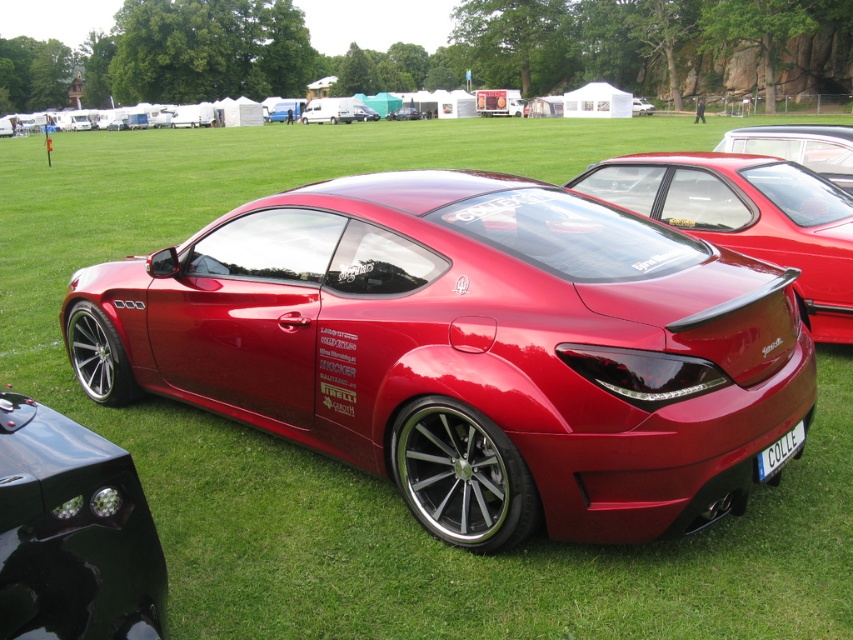
Question: Which of the following is the farthest from the observer?

Choices:
 (A) glossy metallic car at center
 (B) shiny red car at center

Answer: (A)

Question: Does glossy red car at center have a greater width compared to glossy metallic car at center?

Choices:
 (A) yes
 (B) no

Answer: (B)

Question: Does shiny metallic sports car at center come in front of glossy red car at center?

Choices:
 (A) no
 (B) yes

Answer: (B)

Question: Can you confirm if glossy red car at center is bigger than glossy metallic van at center?

Choices:
 (A) no
 (B) yes

Answer: (A)

Question: Among these objects, which one is nearest to the camera?

Choices:
 (A) glossy red car at center
 (B) glossy metallic car at center
 (C) shiny metallic sports car at center
 (D) shiny red car at center

Answer: (C)

Question: Estimate the real-world distances between objects in this image. Which object is farther from the white plastic license plate at rear?

Choices:
 (A) glossy metallic van at center
 (B) shiny metallic sports car at center
 (C) glossy black car at center
 (D) shiny red car at center

Answer: (A)